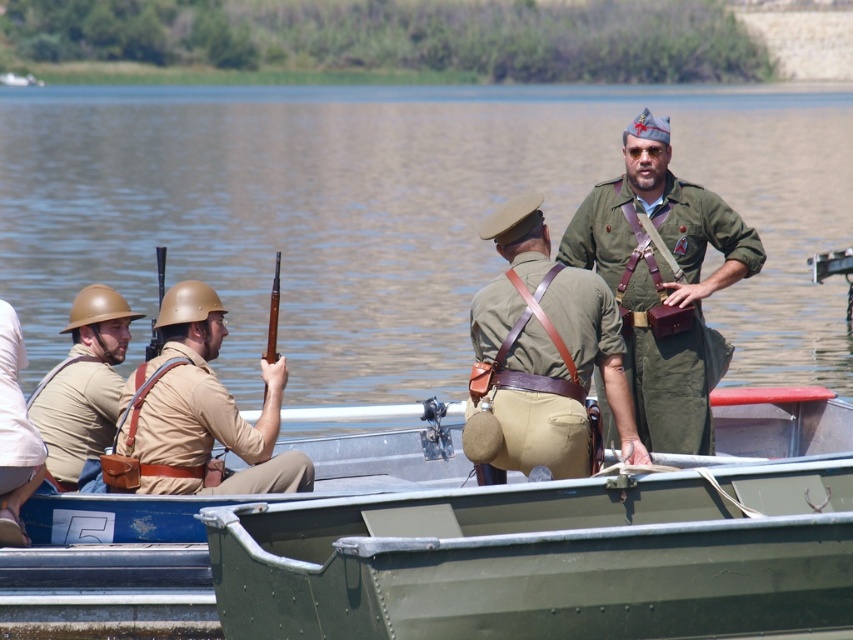
You are a photographer positioned at the origin point of the coordinate system. You want to capture a photo of the green metal boat at center. What are the coordinates where you should aim your camera?

The coordinates to aim the camera are at point (x=483, y=547) to capture the green metal boat at center.

You are a photographer trying to capture both the green metal boat at center and the matte green uniform at center in a single shot. Which object should you focus on first to ensure they are both in frame?

The green metal boat at center is shorter than the matte green uniform at center, so you should focus on the matte green uniform at center first to ensure both are in frame.

You are a participant in the historical reenactment and notice the green metal boat at center and the matte green uniform at center. Which object is positioned lower in the image?

The green metal boat at center is positioned below the matte green uniform at center, so it is lower in the image.